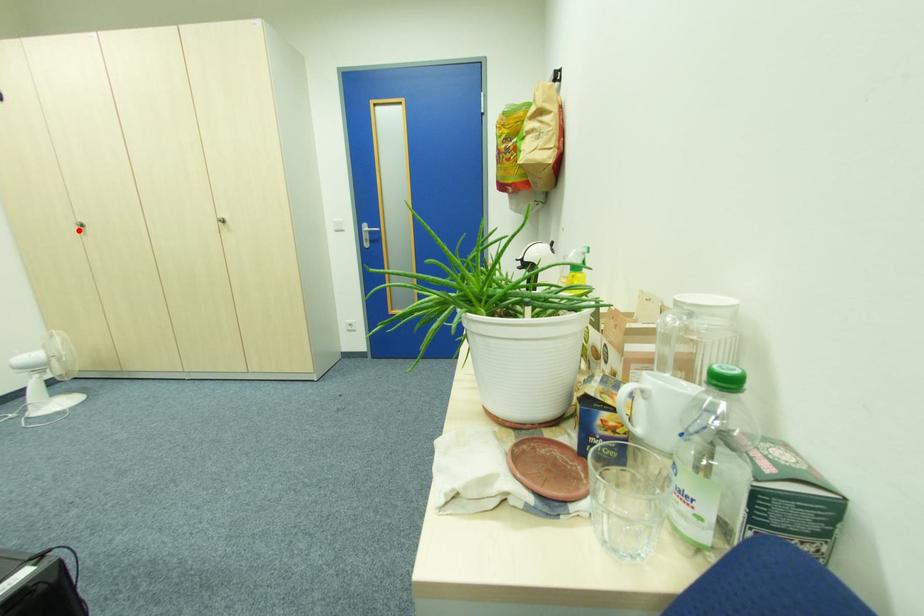
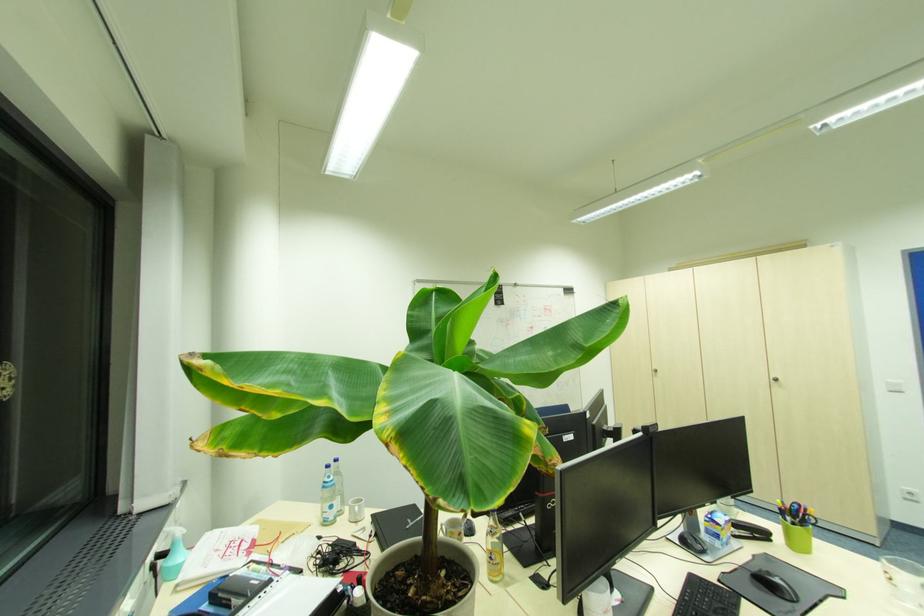
The point at the highlighted location is marked in the first image. Where is the corresponding point in the second image?

(654, 374)